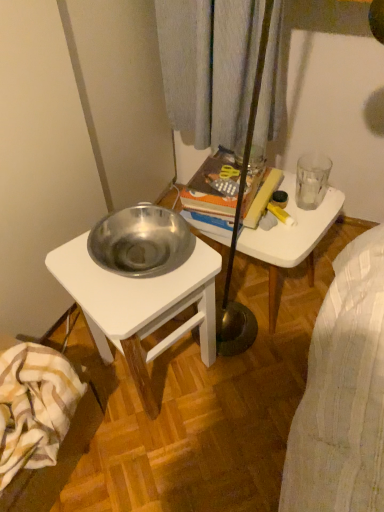
Identify the location of free spot above white glossy table at upper center (from a real-world perspective). (287, 215).